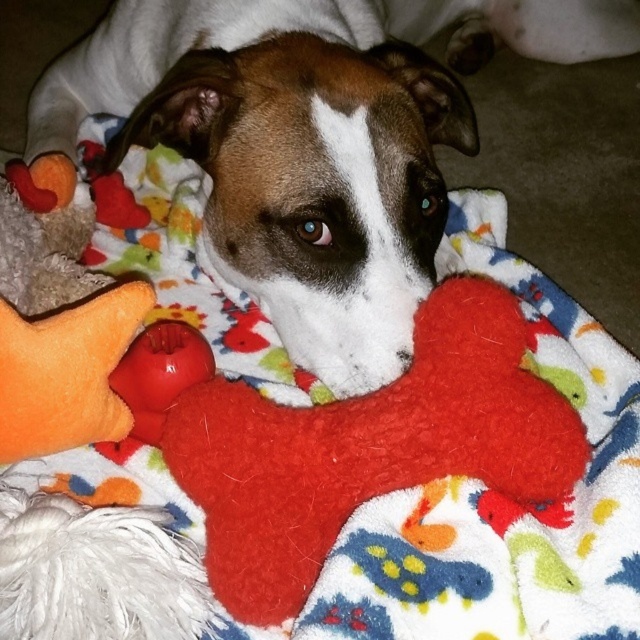
Question: Which object is closer to the camera taking this photo?

Choices:
 (A) orange plush star at lower left
 (B) rubber ball at center
 (C) fuzzy red bone at center

Answer: (C)

Question: Does matte orange plush toy at lower left lie behind orange plush star at lower left?

Choices:
 (A) yes
 (B) no

Answer: (A)

Question: Considering the real-world distances, which object is farthest from the orange plush star at lower left?

Choices:
 (A) rubber ball at center
 (B) matte orange plush toy at lower left
 (C) fuzzy red bone at center

Answer: (B)

Question: Does fuzzy red bone at center appear on the left side of orange plush star at lower left?

Choices:
 (A) no
 (B) yes

Answer: (A)

Question: Which point is farther from the camera taking this photo?

Choices:
 (A) (588, 36)
 (B) (179, 332)
 (C) (4, 352)

Answer: (A)

Question: Does orange plush star at lower left appear on the right side of rubber ball at center?

Choices:
 (A) no
 (B) yes

Answer: (A)